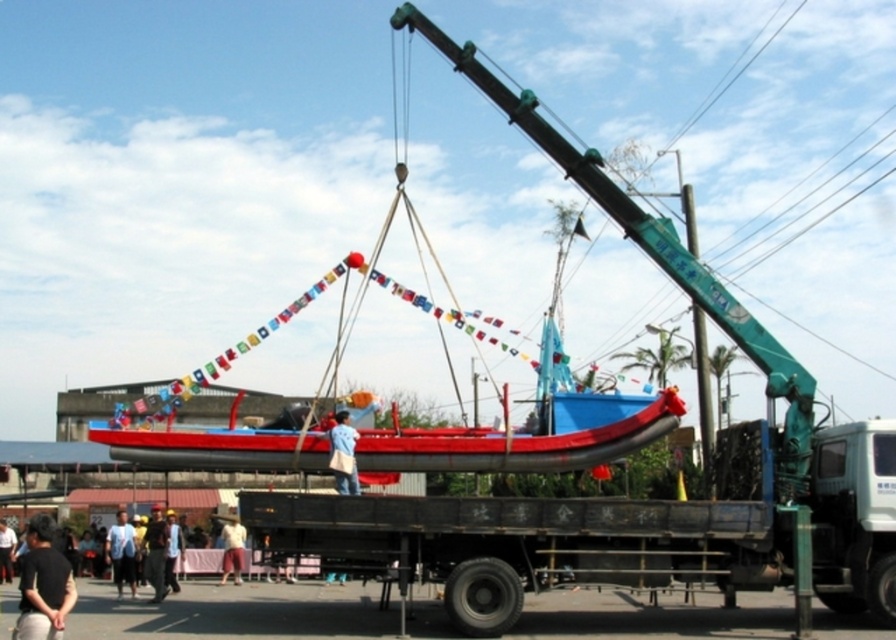
You are a delivery person who needs to place a blue fabric bag at center and a brown fabric shirt at center into a storage container. Based on their positions in the image, which item should you place first to ensure proper stacking?

The blue fabric bag at center should be placed first since it is above the brown fabric shirt at center in the image, indicating it should be at the lower level for proper stacking.